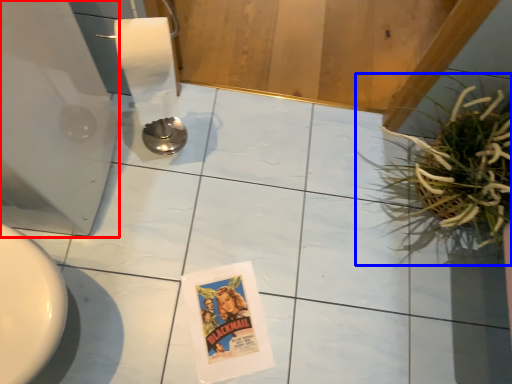
Question: Which object is further to the camera taking this photo, appliance (highlighted by a red box) or houseplant (highlighted by a blue box)?

Choices:
 (A) appliance
 (B) houseplant

Answer: (B)